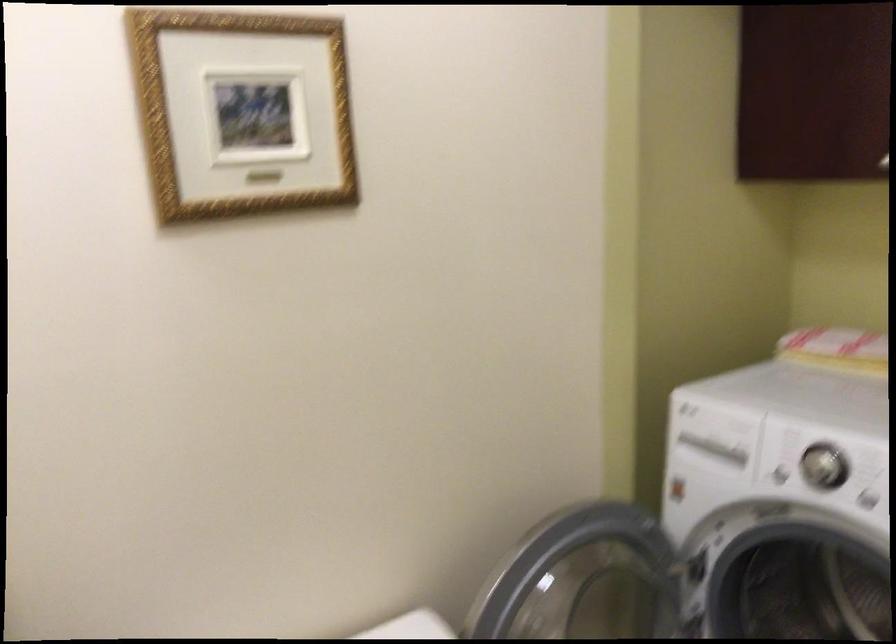
What do you see at coordinates (527, 272) in the screenshot? The image size is (896, 644). I see `the detergent drawer handle` at bounding box center [527, 272].